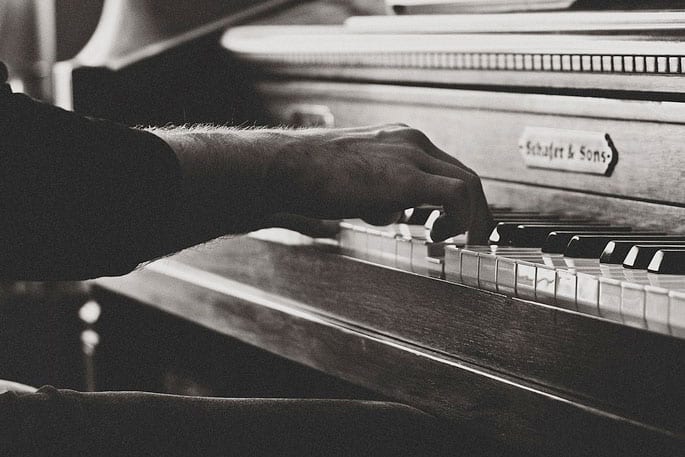
Where is `glare on piano`? This screenshot has width=685, height=457. glare on piano is located at coordinates (105, 36).